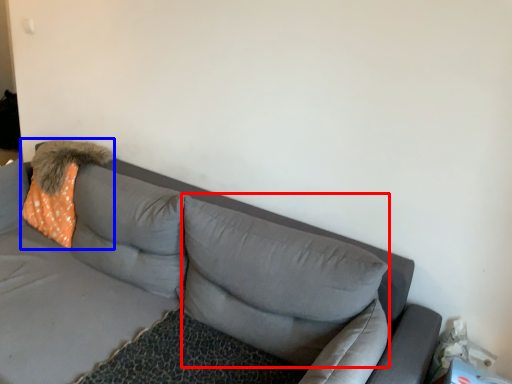
Question: Which object appears closest to the camera in this image, pillow (highlighted by a red box) or throw pillow (highlighted by a blue box)?

Choices:
 (A) pillow
 (B) throw pillow

Answer: (A)